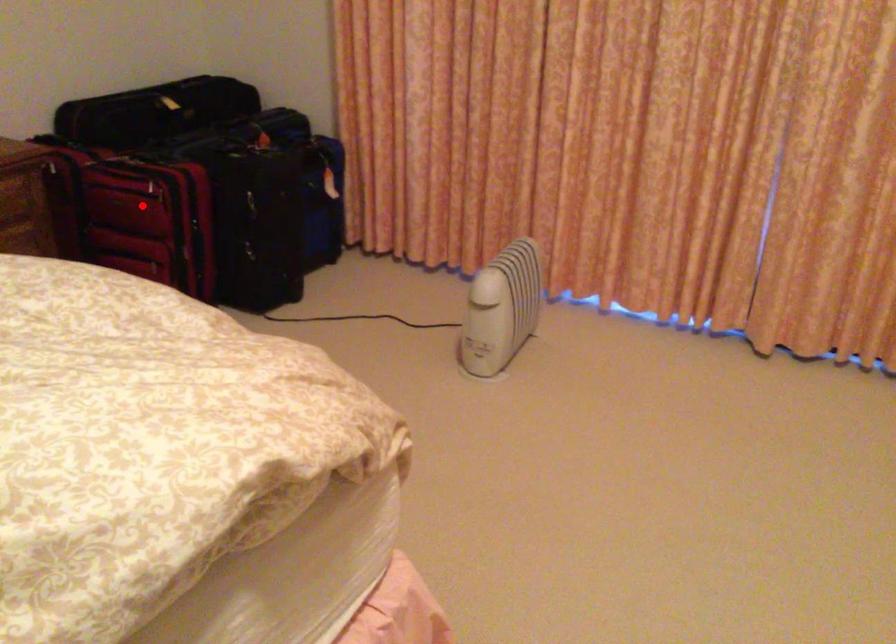
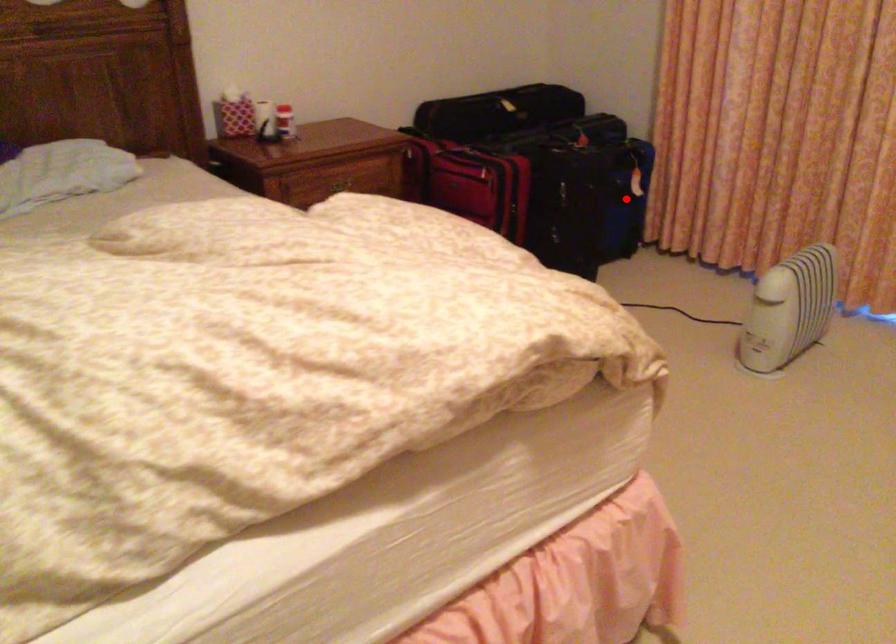
I am providing you with two images of the same scene from different viewpoints. A red point is marked on the first image and another point is marked on the second image. Does the point marked in image1 correspond to the same location as the one in image2?

No